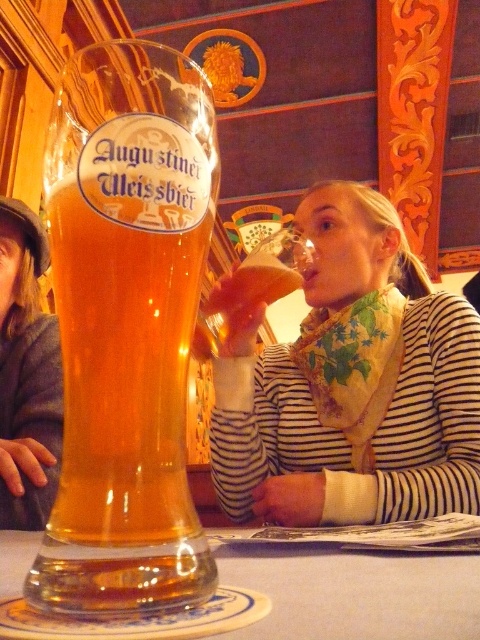
Question: Considering the real-world distances, which object is closest to the translucent glass at lower center?

Choices:
 (A) translucent glass beer glass at left
 (B) striped fabric scarf at upper center

Answer: (A)

Question: Based on their relative distances, which object is nearer to the translucent glass at lower center?

Choices:
 (A) matte gray sweater at left
 (B) striped fabric scarf at upper center
 (C) translucent glass beer glass at left

Answer: (C)

Question: Which is nearer to the translucent glass at lower center?

Choices:
 (A) striped fabric scarf at upper center
 (B) matte gray sweater at left

Answer: (A)

Question: From the image, what is the correct spatial relationship of translucent glass beer glass at left in relation to translucent glass at lower center?

Choices:
 (A) left
 (B) right

Answer: (A)

Question: Is striped fabric scarf at upper center thinner than matte gray sweater at left?

Choices:
 (A) yes
 (B) no

Answer: (B)

Question: From the image, what is the correct spatial relationship of translucent glass at lower center in relation to matte gray sweater at left?

Choices:
 (A) above
 (B) below

Answer: (B)